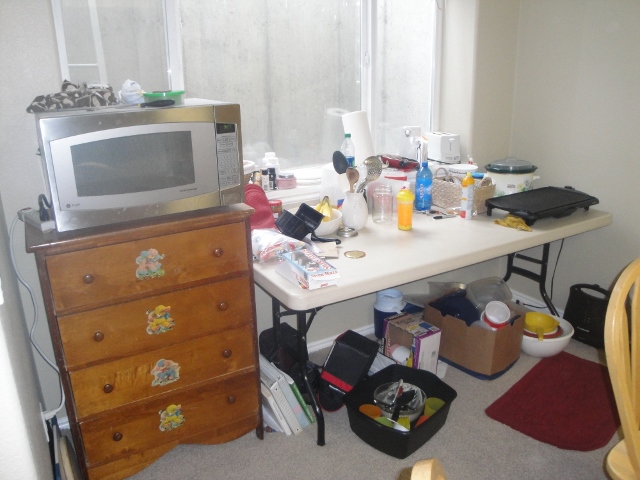
The width and height of the screenshot is (640, 480). What are the coordinates of `microwave` in the screenshot? It's located at (175, 163).